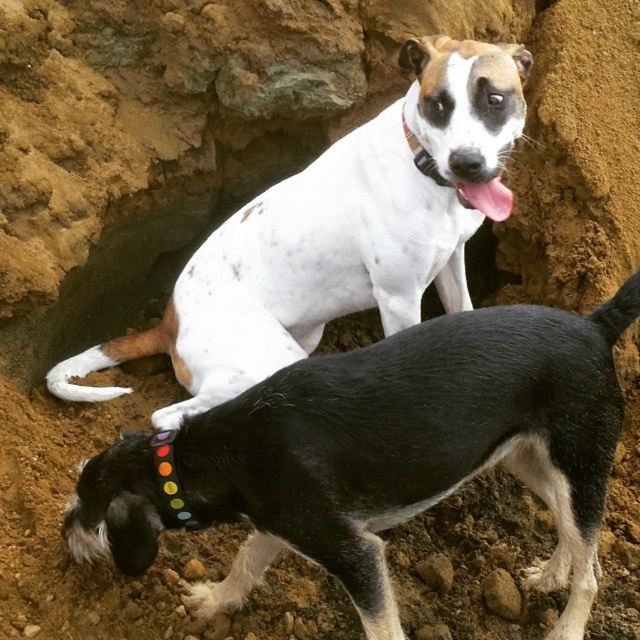
Between rainbow fabric neckband at lower center and black fabric neckband at upper center, which one has more height?

rainbow fabric neckband at lower center is taller.

Measure the distance between rainbow fabric neckband at lower center and black fabric neckband at upper center.

The distance of rainbow fabric neckband at lower center from black fabric neckband at upper center is 26.59 inches.

Measure the distance between point [154,456] and camera.

6.45 feet

You are a GUI agent. You are given a task and a screenshot of the screen. Output one action in this format:
    pyautogui.click(x=<x>, y=<y>)
    Task: Click on the rainbow fabric neckband at lower center
    The height and width of the screenshot is (640, 640).
    Given the screenshot: What is the action you would take?
    pyautogui.click(x=170, y=477)

The width and height of the screenshot is (640, 640). Describe the element at coordinates (413, 448) in the screenshot. I see `black smooth dog at center` at that location.

Which is above, black smooth dog at center or black fabric neckband at upper center?

Positioned higher is black fabric neckband at upper center.

Between point (355, 580) and point (436, 177), which one is positioned behind?

The point (436, 177) is behind.

This screenshot has height=640, width=640. I want to click on black smooth dog at center, so click(x=413, y=448).

Does white speckled fur at center appear over rainbow fabric neckband at lower center?

Yes, white speckled fur at center is above rainbow fabric neckband at lower center.

Which is in front, point (448, 188) or point (152, 436)?

Point (152, 436)

Locate an element on the screen. white speckled fur at center is located at coordinates (337, 234).

The image size is (640, 640). In order to click on white speckled fur at center in this screenshot , I will do `click(337, 234)`.